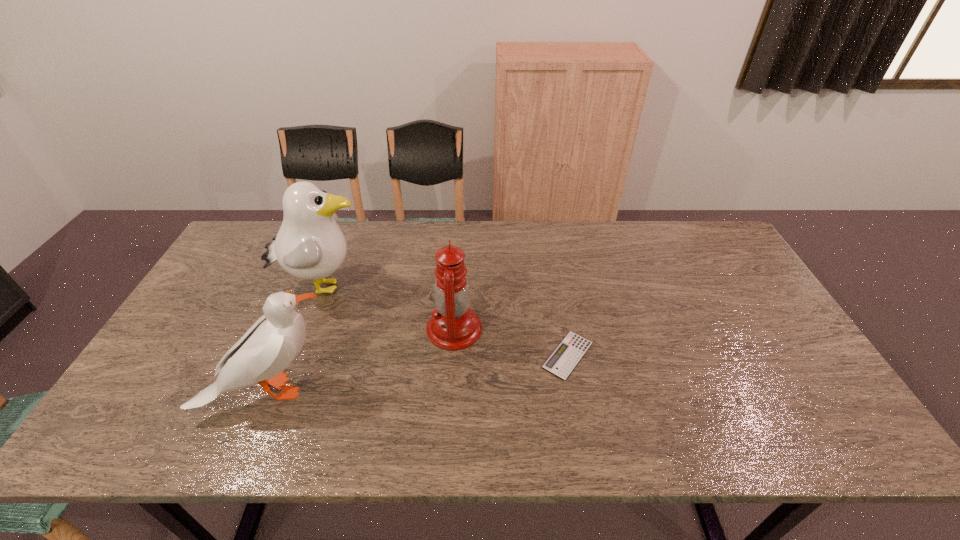
This screenshot has height=540, width=960. Find the location of `the taller gull`. the taller gull is located at coordinates (309, 245).

This screenshot has width=960, height=540. What are the coordinates of `oil lamp` in the screenshot? It's located at (453, 326).

Where is `the nearer gull`? This screenshot has width=960, height=540. the nearer gull is located at coordinates (270, 345).

I want to click on the rightmost object, so click(x=566, y=356).

Image resolution: width=960 pixels, height=540 pixels. I want to click on calculator, so click(566, 356).

Locate an element on the screen. vacant space located on the beak of the taller gull is located at coordinates [x=414, y=286].

Image resolution: width=960 pixels, height=540 pixels. Find the location of `vacant space located 0.290m on the left of the second object from right to left`. vacant space located 0.290m on the left of the second object from right to left is located at coordinates (323, 329).

Where is `vacant area located at the beak of the shorter gull`? vacant area located at the beak of the shorter gull is located at coordinates click(x=403, y=390).

The image size is (960, 540). I want to click on vacant region located on the back of the shortest object, so click(558, 301).

The width and height of the screenshot is (960, 540). Find the location of `object at the far edge`. object at the far edge is located at coordinates (309, 245).